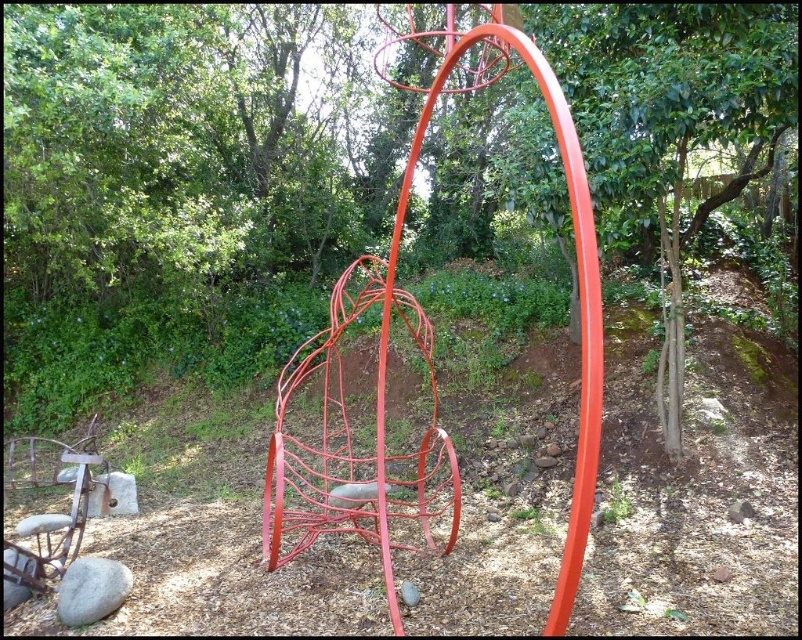
You are standing in front of the sculpture and want to shoot a basketball into the glossy metal basketball hoop at center. If your maximum shooting distance is 2.5 meters, can you reach the hoop?

The distance between you and the glossy metal basketball hoop at center is 2.65 meters, which exceeds your maximum shooting distance of 2.5 meters. Therefore, you cannot reach the hoop.

What are the coordinates of the glossy metal basketball hoop at center?

The glossy metal basketball hoop at center is located at coordinates point (428,356).